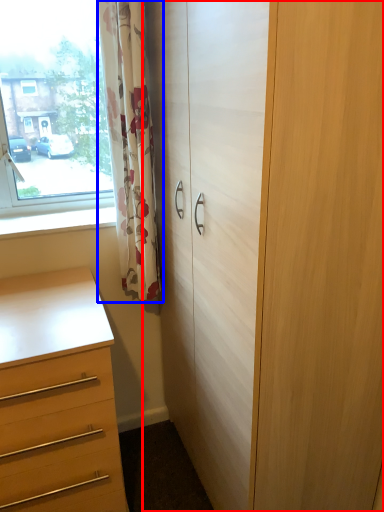
Question: Which object is closer to the camera taking this photo, cupboard (highlighted by a red box) or curtain (highlighted by a blue box)?

Choices:
 (A) cupboard
 (B) curtain

Answer: (A)